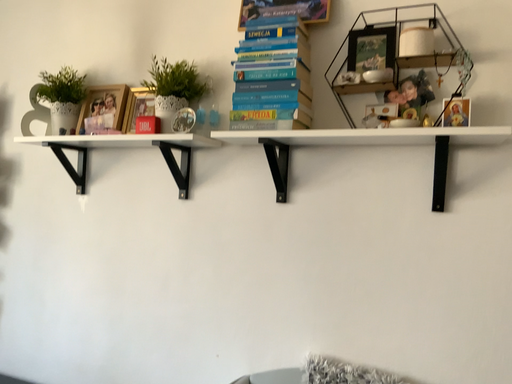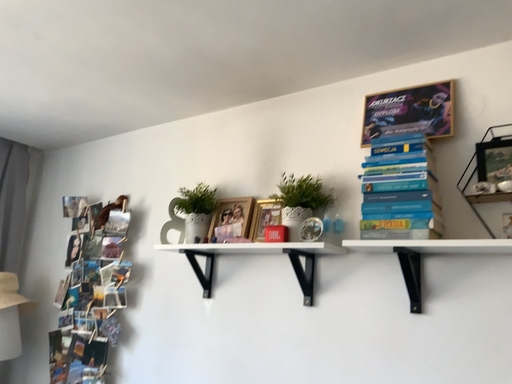
Question: Which way did the camera rotate in the video?

Choices:
 (A) rotated left
 (B) rotated right

Answer: (A)